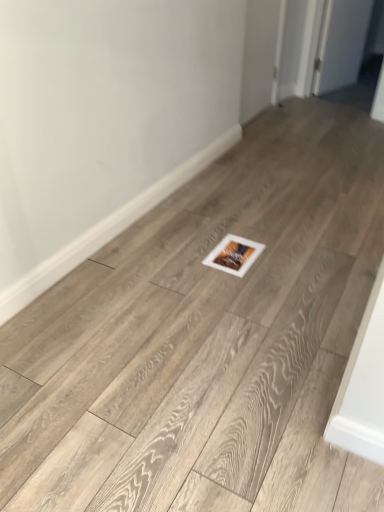
Where is `empty space that is to the right of white matte picture frame at center`? empty space that is to the right of white matte picture frame at center is located at coordinates (280, 250).